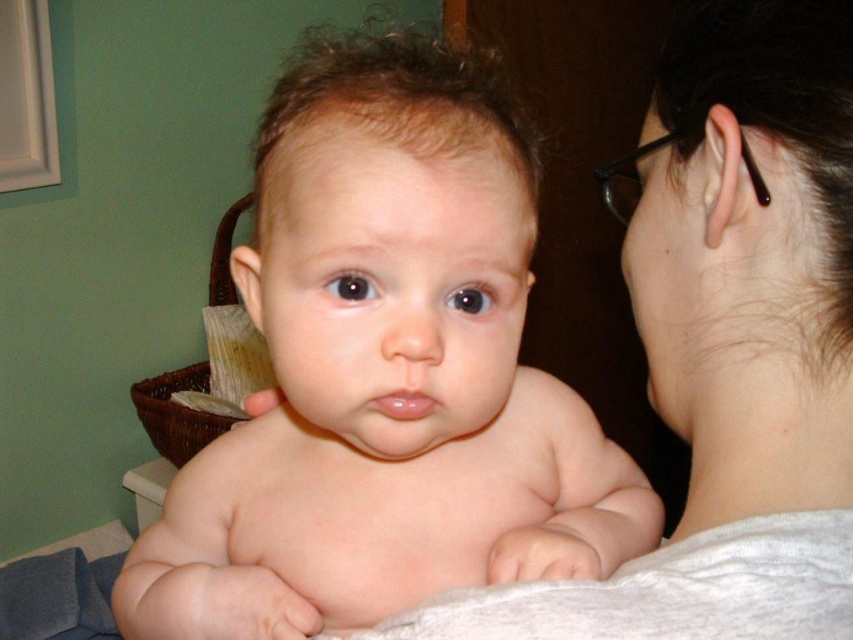
Between smooth skin baby at center and white fabric at upper right, which one appears on the right side from the viewer's perspective?

From the viewer's perspective, white fabric at upper right appears more on the right side.

Between smooth skin baby at center and white fabric at upper right, which one is positioned lower?

Positioned lower is smooth skin baby at center.

The image size is (853, 640). I want to click on smooth skin baby at center, so click(386, 372).

Find the location of `smooth skin baby at center`. smooth skin baby at center is located at coordinates (386, 372).